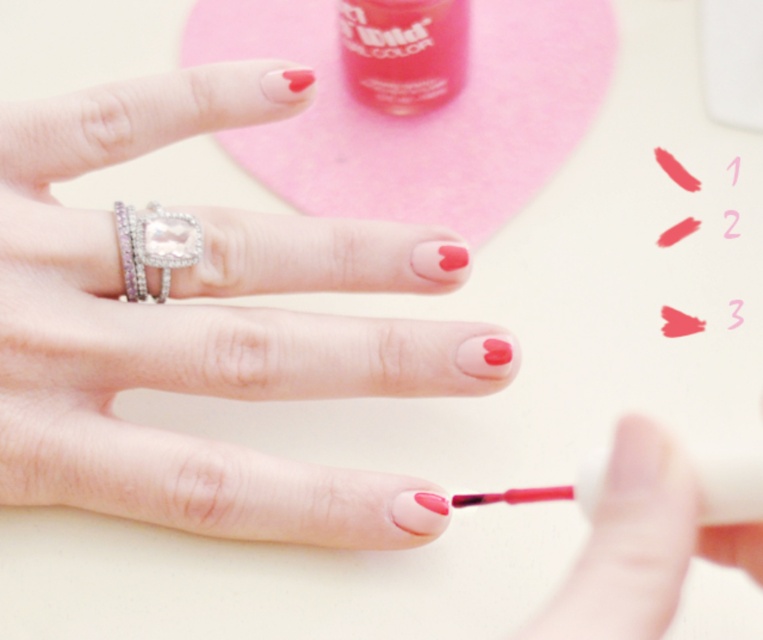
You are a photographer trying to capture a closeup shot of the ring on the ring finger. The ring is located at point (145,340). You want to ensure the ring is in focus. Given that the camera is 16.67 inches away from the point, is the distance sufficient for a clear focus?

The distance between the camera and point (145,340) is 16.67 inches, which is sufficient for a clear focus as most cameras can focus effectively at this distance.

You are a nail artist and need to place a new bottle of nail polish on the pink felt mat. The existing matte pink nail polish at center is at point 0.534, 0.249. If you want to place the new bottle 10 cm to the right of the existing one, where would you place it?

The new bottle should be placed at point (x=188, y=404), which is 10 cm to the right of the existing matte pink nail polish at center at (x=188, y=340).

You are a nail artist and need to place a diamond ring at left on the pink felt mat. Where should you place it so that it doesn not interfere with the existing nail polish bottle?

The diamond ring at left should be placed at point (x=153, y=244) to avoid interfering with the nail polish bottle.